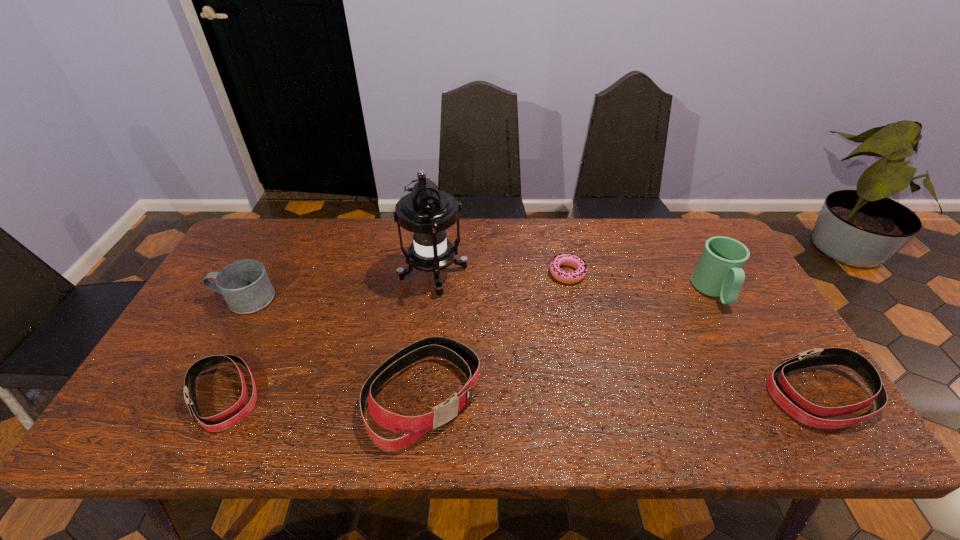
Find the location of a particular element. This screenshot has height=540, width=960. the left mug is located at coordinates (245, 286).

The height and width of the screenshot is (540, 960). I want to click on free space located 0.370m on the back of the leftmost dog collar, so click(x=287, y=265).

I want to click on free spot located 0.210m on the left of the tallest dog collar, so click(276, 395).

Where is `vacant space located on the back of the second tallest dog collar`? This screenshot has width=960, height=540. vacant space located on the back of the second tallest dog collar is located at coordinates (783, 338).

Where is `vacant region located 0.130m on the side of the second tallest object with the handle`? The width and height of the screenshot is (960, 540). vacant region located 0.130m on the side of the second tallest object with the handle is located at coordinates (746, 350).

You are a GUI agent. You are given a task and a screenshot of the screen. Output one action in this format:
    pyautogui.click(x=<x>, y=<y>)
    Task: Click on the vacant space located on the right of the lantern
    
    Given the screenshot: What is the action you would take?
    pyautogui.click(x=530, y=274)

This screenshot has height=540, width=960. Identify the location of vacant space located 0.350m on the right of the shortest object. (700, 273).

The height and width of the screenshot is (540, 960). I want to click on lantern present at the far edge, so click(x=426, y=212).

Where is `doughnut that is positioned at the far edge`? doughnut that is positioned at the far edge is located at coordinates (578, 263).

The height and width of the screenshot is (540, 960). I want to click on dog collar that is positioned at the left edge, so click(x=191, y=375).